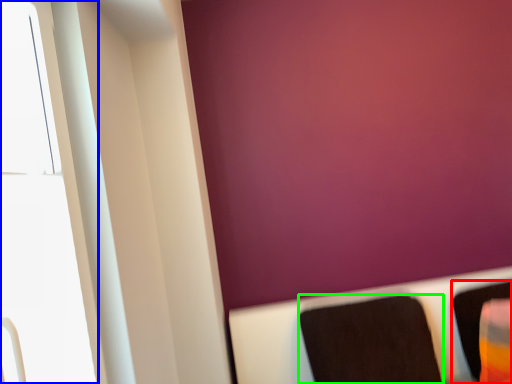
Question: Which is farther away from furniture (highlighted by a red box)? window (highlighted by a blue box) or furniture (highlighted by a green box)?

Choices:
 (A) window
 (B) furniture

Answer: (A)